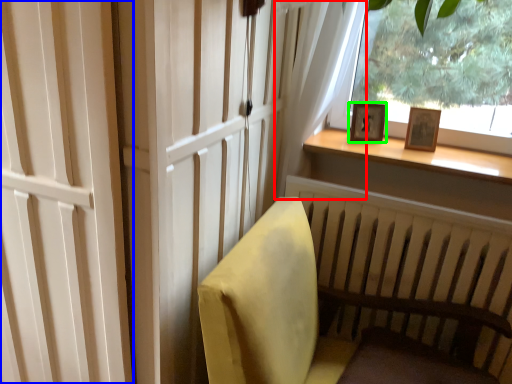
Question: Based on their relative distances, which object is farther from curtain (highlighted by a red box)? Choose from screen door (highlighted by a blue box) and picture frame (highlighted by a green box).

Choices:
 (A) screen door
 (B) picture frame

Answer: (A)